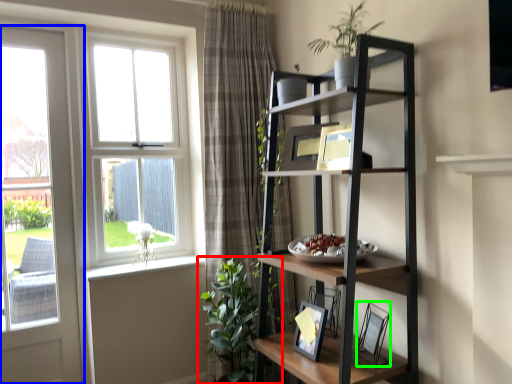
Question: Estimate the real-world distances between objects in this image. Which object is closer to houseplant (highlighted by a red box), door (highlighted by a blue box) or picture frame (highlighted by a green box)?

Choices:
 (A) door
 (B) picture frame

Answer: (B)